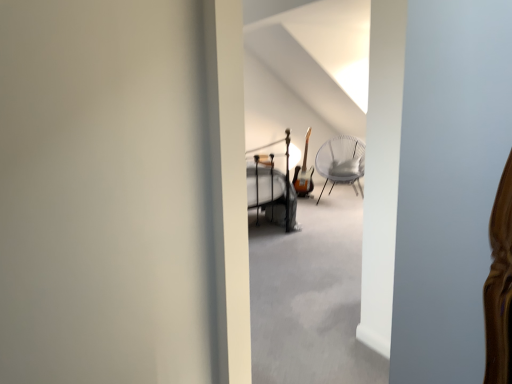
At what (x,y) coordinates should I click in order to perform the action: click on metallic silver bunk bed at center. Please return your answer as a coordinate pair (x, y). Image resolution: width=512 pixels, height=384 pixels. Looking at the image, I should click on (272, 184).

This screenshot has height=384, width=512. Describe the element at coordinates (272, 184) in the screenshot. I see `metallic silver bunk bed at center` at that location.

At what (x,y) coordinates should I click in order to perform the action: click on white wicker chair at center. Please return your answer as a coordinate pair (x, y). The width and height of the screenshot is (512, 384). Looking at the image, I should click on pos(341,162).

Describe the element at coordinates (341, 162) in the screenshot. The width and height of the screenshot is (512, 384). I see `white wicker chair at center` at that location.

The image size is (512, 384). I want to click on metallic silver bunk bed at center, so click(272, 184).

Would you say metallic silver bunk bed at center is to the left or to the right of white wicker chair at center in the picture?

metallic silver bunk bed at center is to the left of white wicker chair at center.

Is metallic silver bunk bed at center closer to the viewer compared to white wicker chair at center?

That is True.

Which is in front, point (278, 178) or point (333, 182)?

The point (278, 178) is closer to the camera.

From the image's perspective, is metallic silver bunk bed at center above white wicker chair at center?

Actually, metallic silver bunk bed at center appears below white wicker chair at center in the image.

From a real-world perspective, between metallic silver bunk bed at center and white wicker chair at center, who is vertically lower?

white wicker chair at center.

Does metallic silver bunk bed at center have a lesser width compared to white wicker chair at center?

Incorrect, the width of metallic silver bunk bed at center is not less than that of white wicker chair at center.

Considering the sizes of objects metallic silver bunk bed at center and white wicker chair at center in the image provided, who is taller, metallic silver bunk bed at center or white wicker chair at center?

metallic silver bunk bed at center.

Between metallic silver bunk bed at center and white wicker chair at center, which one has larger size?

metallic silver bunk bed at center is bigger.

Is metallic silver bunk bed at center inside or outside of white wicker chair at center?

metallic silver bunk bed at center cannot be found inside white wicker chair at center.

Would you consider metallic silver bunk bed at center to be distant from white wicker chair at center?

Yes, metallic silver bunk bed at center is far from white wicker chair at center.

Is metallic silver bunk bed at center turned away from white wicker chair at center?

No, white wicker chair at center is not at the back of metallic silver bunk bed at center.

What's the angular difference between metallic silver bunk bed at center and white wicker chair at center's facing directions?

45.6 degrees separate the facing orientations of metallic silver bunk bed at center and white wicker chair at center.

Find the location of a particular element. This screenshot has width=512, height=384. chair located underneath the metallic silver bunk bed at center (from a real-world perspective) is located at coordinates (341, 162).

Which is more to the left, white wicker chair at center or metallic silver bunk bed at center?

From the viewer's perspective, metallic silver bunk bed at center appears more on the left side.

Between white wicker chair at center and metallic silver bunk bed at center, which one is positioned behind?

Positioned behind is white wicker chair at center.

Which is nearer, (330,142) or (254,156)?

Point (330,142).

From the image's perspective, which is below, white wicker chair at center or metallic silver bunk bed at center?

metallic silver bunk bed at center, from the image's perspective.

From a real-world perspective, is white wicker chair at center over metallic silver bunk bed at center?

No, from a real-world perspective, white wicker chair at center is not over metallic silver bunk bed at center

Which object is thinner, white wicker chair at center or metallic silver bunk bed at center?

Thinner between the two is white wicker chair at center.

From the picture: Is white wicker chair at center taller than metallic silver bunk bed at center?

No, white wicker chair at center is not taller than metallic silver bunk bed at center.

Which of these two, white wicker chair at center or metallic silver bunk bed at center, is bigger?

metallic silver bunk bed at center.

Which is correct: white wicker chair at center is inside metallic silver bunk bed at center, or outside of it?

white wicker chair at center is spatially situated outside metallic silver bunk bed at center.

Is white wicker chair at center not near metallic silver bunk bed at center?

That's right, there is a large distance between white wicker chair at center and metallic silver bunk bed at center.

Is white wicker chair at center aimed at metallic silver bunk bed at center?

No, white wicker chair at center is not turned towards metallic silver bunk bed at center.

Can you tell me how much white wicker chair at center and metallic silver bunk bed at center differ in facing direction?

The angle between the facing direction of white wicker chair at center and the facing direction of metallic silver bunk bed at center is 45.6 degrees.

In the image, there is a metallic silver bunk bed at center. Identify the location of chair below it (from a real-world perspective). (341, 162).

The width and height of the screenshot is (512, 384). In the image, there is a white wicker chair at center. Find the location of `bunk bed below it (from the image's perspective)`. bunk bed below it (from the image's perspective) is located at coordinates (272, 184).

Find the location of a particular element. chair located behind the metallic silver bunk bed at center is located at coordinates click(x=341, y=162).